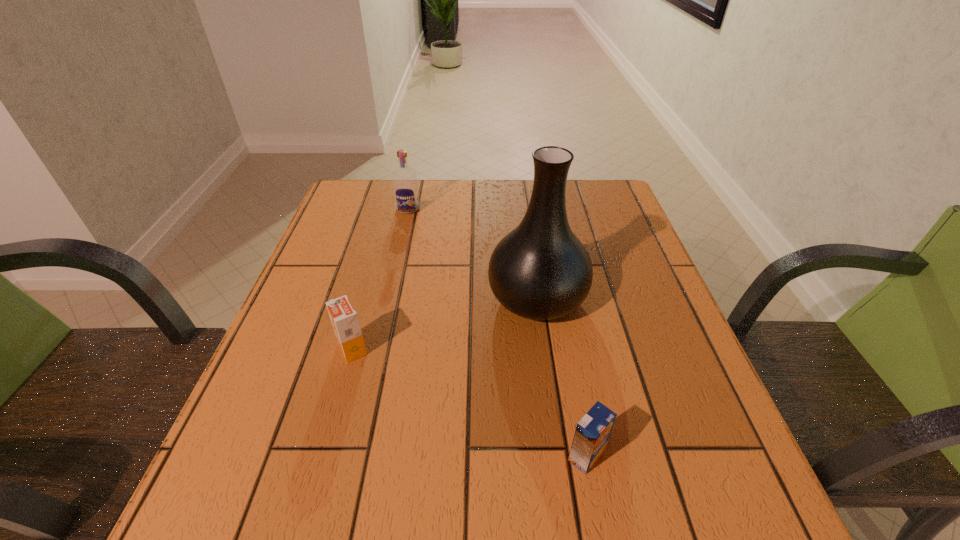
The width and height of the screenshot is (960, 540). I want to click on free space at the near right corner of the desktop, so click(x=703, y=505).

Find the location of `vacant space in between the vase and the left orange_juice`. vacant space in between the vase and the left orange_juice is located at coordinates (444, 323).

Find the location of `blank region between the farther orange_juice and the vase`. blank region between the farther orange_juice and the vase is located at coordinates (444, 323).

I want to click on free point between the vodka and the left orange_juice, so pos(380,279).

Where is `vacant point located between the farthest object and the tallest object`? Image resolution: width=960 pixels, height=540 pixels. vacant point located between the farthest object and the tallest object is located at coordinates (472, 253).

The image size is (960, 540). Identify the location of free space between the farthest object and the second farthest object. (472, 253).

In order to click on vacant area that lies between the tallest object and the left orange_juice in this screenshot , I will do `click(444, 323)`.

At what (x,y) coordinates should I click in order to perform the action: click on vacant area that lies between the tallest object and the farthest object. Please return your answer as a coordinate pair (x, y). The height and width of the screenshot is (540, 960). Looking at the image, I should click on (472, 253).

I want to click on free point between the farther orange_juice and the farthest object, so click(380, 279).

Where is `vacant area between the farthest object and the left orange_juice`? The height and width of the screenshot is (540, 960). vacant area between the farthest object and the left orange_juice is located at coordinates click(x=380, y=279).